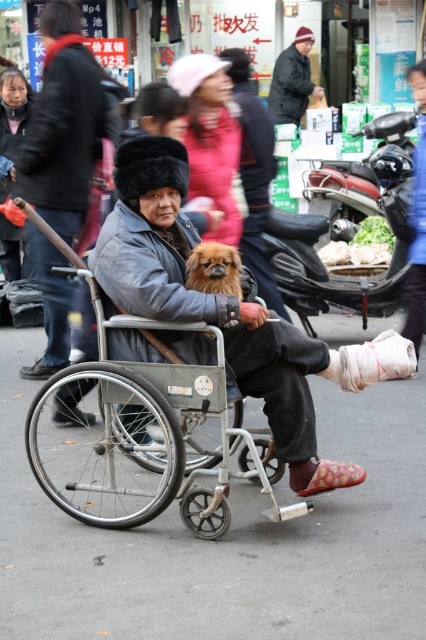
Question: Does metallic gray wheelchair at center have a larger size compared to dark gray jacket at center?

Choices:
 (A) yes
 (B) no

Answer: (A)

Question: Among these objects, which one is farthest from the camera?

Choices:
 (A) matte gray coat at center
 (B) metallic red motorcycle at right

Answer: (B)

Question: Is gray woolen jacket at center in front of metallic red motorcycle at right?

Choices:
 (A) no
 (B) yes

Answer: (B)

Question: Which is farther from the fluffy brown dog at center?

Choices:
 (A) matte gray coat at center
 (B) metallic gray wheelchair at center
 (C) dark gray fabric jacket at center

Answer: (C)

Question: Which point is farther from the camera taking this photo?

Choices:
 (A) (2, 196)
 (B) (43, 140)

Answer: (A)

Question: Is dark gray fabric coat at center below dark gray jacket at center?

Choices:
 (A) yes
 (B) no

Answer: (A)